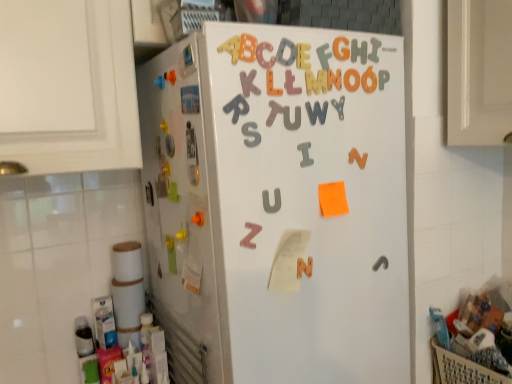
Question: Does pink matte letter z at center lie behind matte plastic letter t at center, the 1th letter in the left-to-right sequence?

Choices:
 (A) no
 (B) yes

Answer: (A)

Question: Is pink matte letter z at center bigger than matte plastic letter t at center, which is the ninth letter from right to left?

Choices:
 (A) no
 (B) yes

Answer: (B)

Question: Can you confirm if pink matte letter z at center is wider than matte plastic letter t at center, which is the ninth letter from right to left?

Choices:
 (A) yes
 (B) no

Answer: (A)

Question: Can we say pink matte letter z at center lies outside matte plastic letter t at center, the 1th letter in the left-to-right sequence?

Choices:
 (A) yes
 (B) no

Answer: (A)

Question: Could you tell me if pink matte letter z at center is turned towards matte plastic letter t at center, the 1th letter in the left-to-right sequence?

Choices:
 (A) yes
 (B) no

Answer: (B)

Question: In terms of width, does matte plastic letter t at center, which is the ninth letter from right to left, look wider or thinner when compared to gray rubber letter y at upper center, the 1th letter when ordered from right to left?

Choices:
 (A) thin
 (B) wide

Answer: (B)

Question: Considering their positions, is matte plastic letter t at center, the 1th letter in the left-to-right sequence, located in front of or behind gray rubber letter y at upper center, the 1th letter when ordered from right to left?

Choices:
 (A) behind
 (B) front

Answer: (B)

Question: From the image's perspective, is matte plastic letter t at center, which is the ninth letter from right to left, above or below gray rubber letter y at upper center, the 1th letter when ordered from right to left?

Choices:
 (A) above
 (B) below

Answer: (B)

Question: Is matte plastic letter t at center, the 1th letter in the left-to-right sequence, bigger or smaller than gray rubber letter y at upper center, the 1th letter when ordered from right to left?

Choices:
 (A) small
 (B) big

Answer: (B)

Question: In the image, is gray matte letter w at upper center, which is the 4th letter in right-to-left order, positioned in front of or behind rubberized plastic letter f at upper center, placed as the 7th letter when sorted from left to right?

Choices:
 (A) behind
 (B) front

Answer: (A)

Question: In terms of height, does gray matte letter w at upper center, which is the 4th letter in right-to-left order, look taller or shorter compared to rubberized plastic letter f at upper center, placed as the 3th letter when sorted from right to left?

Choices:
 (A) tall
 (B) short

Answer: (B)

Question: From the image's perspective, is gray matte letter w at upper center, which is the 4th letter in right-to-left order, positioned above or below rubberized plastic letter f at upper center, placed as the 7th letter when sorted from left to right?

Choices:
 (A) below
 (B) above

Answer: (A)

Question: Is gray matte letter w at upper center, which is the 4th letter in right-to-left order, bigger or smaller than rubberized plastic letter f at upper center, placed as the 3th letter when sorted from right to left?

Choices:
 (A) big
 (B) small

Answer: (B)

Question: Considering the positions of rubberized plastic letter f at upper center, placed as the 7th letter when sorted from left to right, and matte plastic letter t at center, which is the ninth letter from right to left, in the image, is rubberized plastic letter f at upper center, placed as the 7th letter when sorted from left to right, wider or thinner than matte plastic letter t at center, which is the ninth letter from right to left,?

Choices:
 (A) thin
 (B) wide

Answer: (B)

Question: From a real-world perspective, relative to matte plastic letter t at center, which is the ninth letter from right to left, is rubberized plastic letter f at upper center, placed as the 7th letter when sorted from left to right, vertically above or below?

Choices:
 (A) below
 (B) above

Answer: (B)